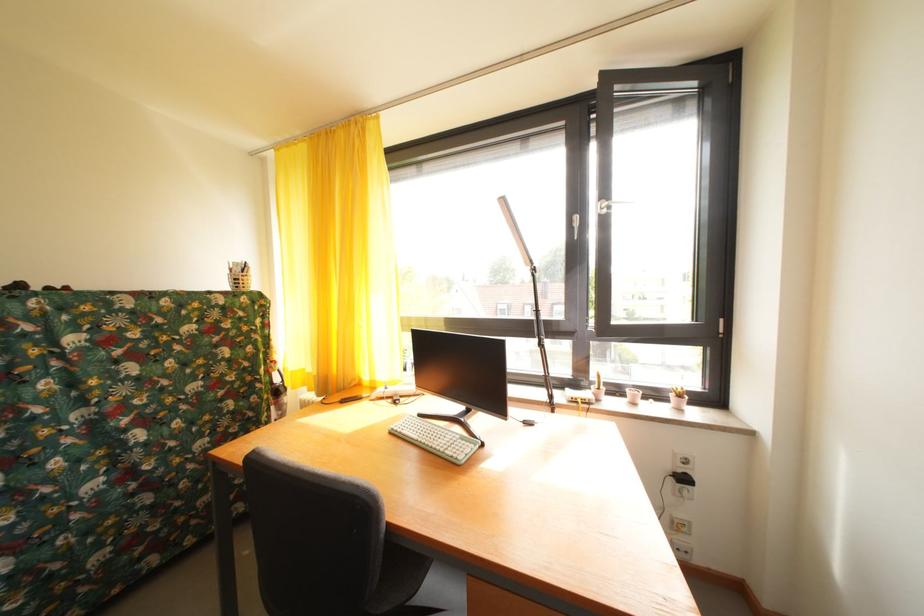
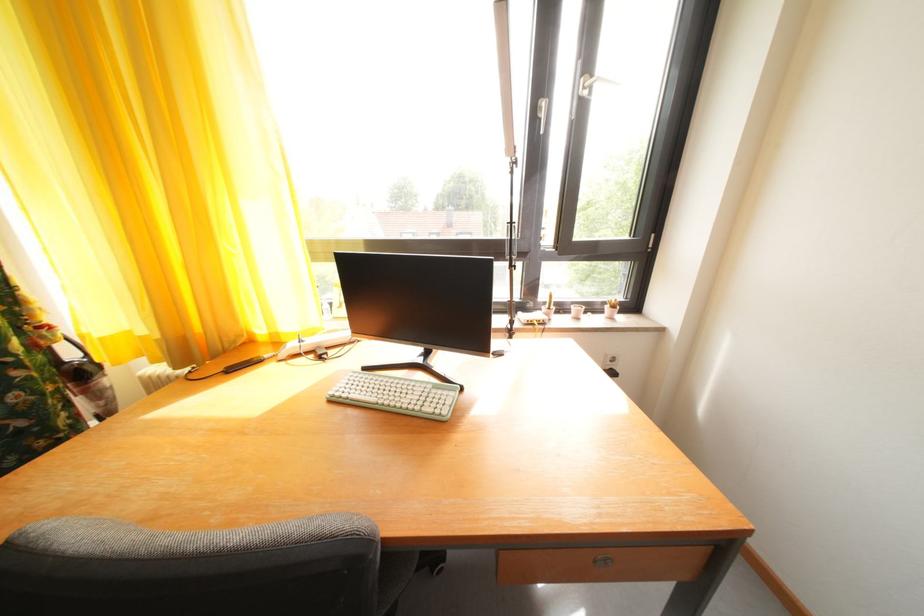
In a continuous first-person perspective shot, in which direction is the camera moving?

The movement direction of the cameraman is left, forward.